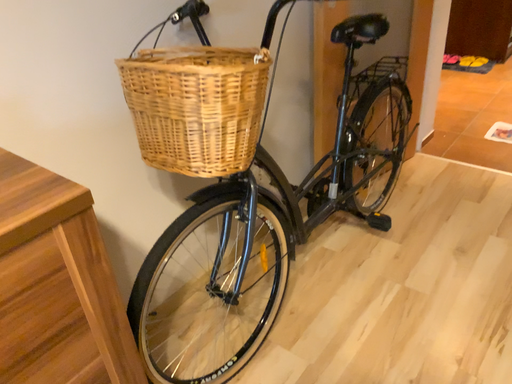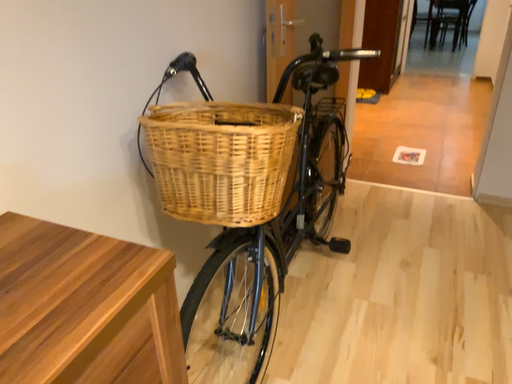
Question: Which way did the camera rotate in the video?

Choices:
 (A) rotated left
 (B) rotated right

Answer: (B)